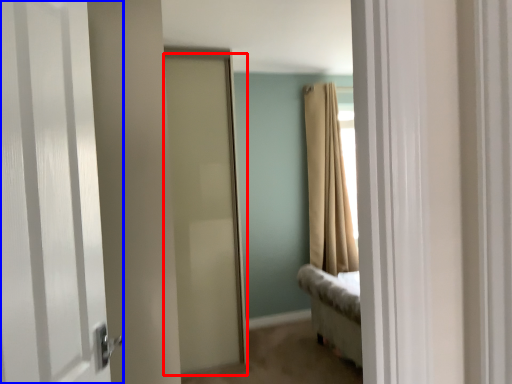
Question: Which point is further to the camera, door (highlighted by a red box) or door (highlighted by a blue box)?

Choices:
 (A) door
 (B) door

Answer: (A)